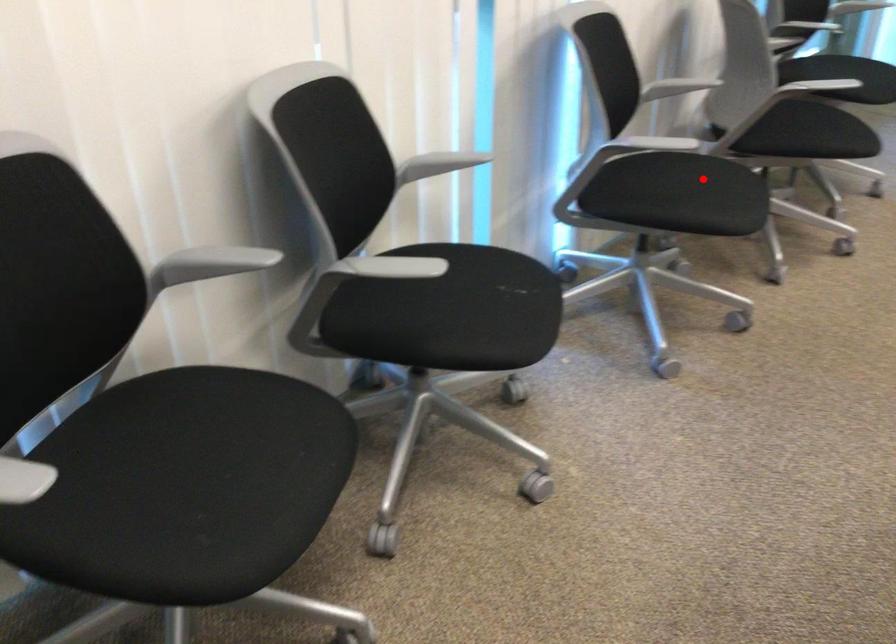
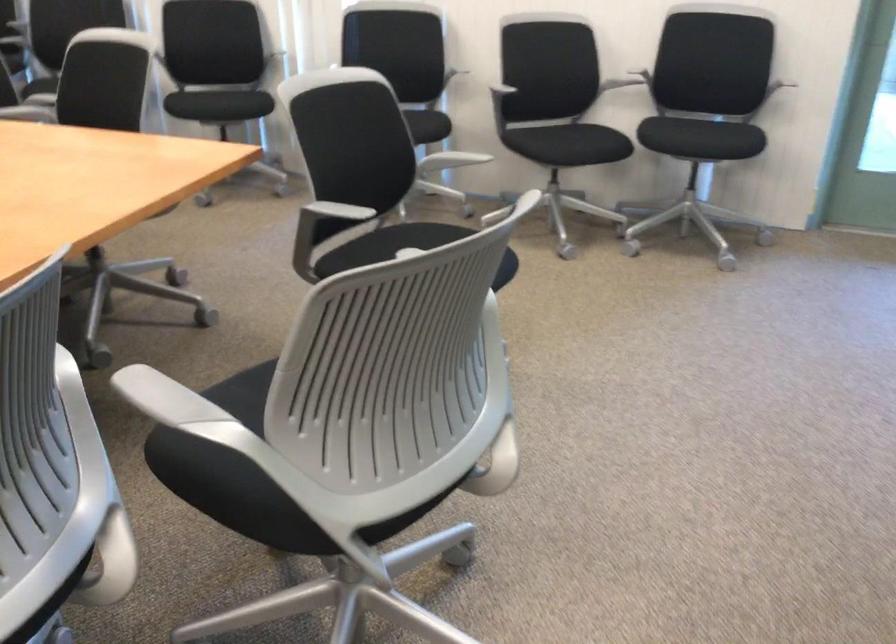
Locate, in the second image, the point that corresponds to the highlighted location in the first image.

(426, 126)